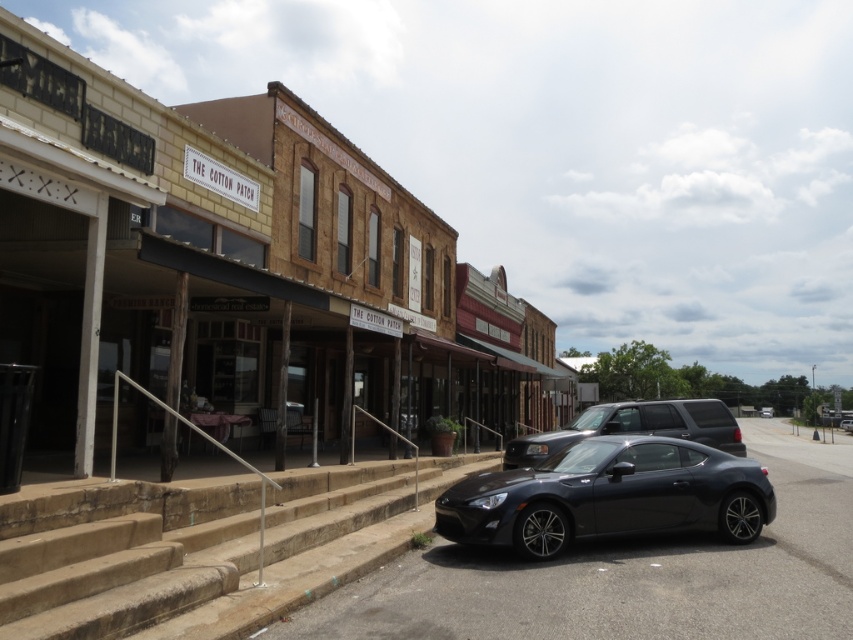
Question: Which of the following is the closest to the observer?

Choices:
 (A) (595, 412)
 (B) (770, 413)
 (C) (512, 540)

Answer: (C)

Question: Which of the following is the farthest from the observer?

Choices:
 (A) glossy black car at lower center
 (B) satin black car at center
 (C) matte brick building at center
 (D) stone steps at center

Answer: (B)

Question: Does satin black car at center have a greater width compared to shiny black car at center?

Choices:
 (A) no
 (B) yes

Answer: (B)

Question: Does matte brick building at center appear over glossy black car at lower center?

Choices:
 (A) yes
 (B) no

Answer: (A)

Question: Does stone steps at center appear on the right side of shiny black car at center?

Choices:
 (A) no
 (B) yes

Answer: (A)

Question: Among these points, which one is nearest to the camera?

Choices:
 (A) (61, 502)
 (B) (387, 355)
 (C) (740, 540)
 (D) (764, 416)

Answer: (A)